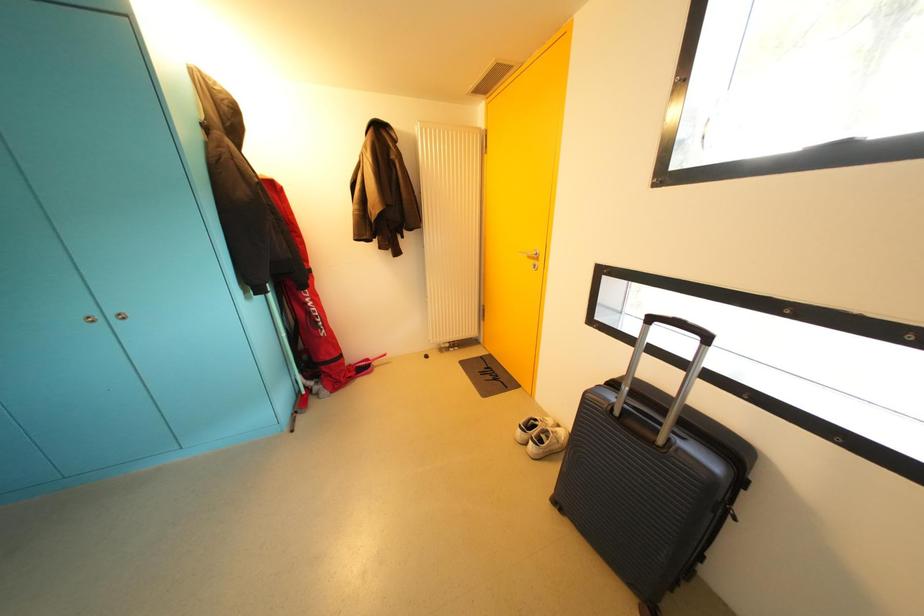
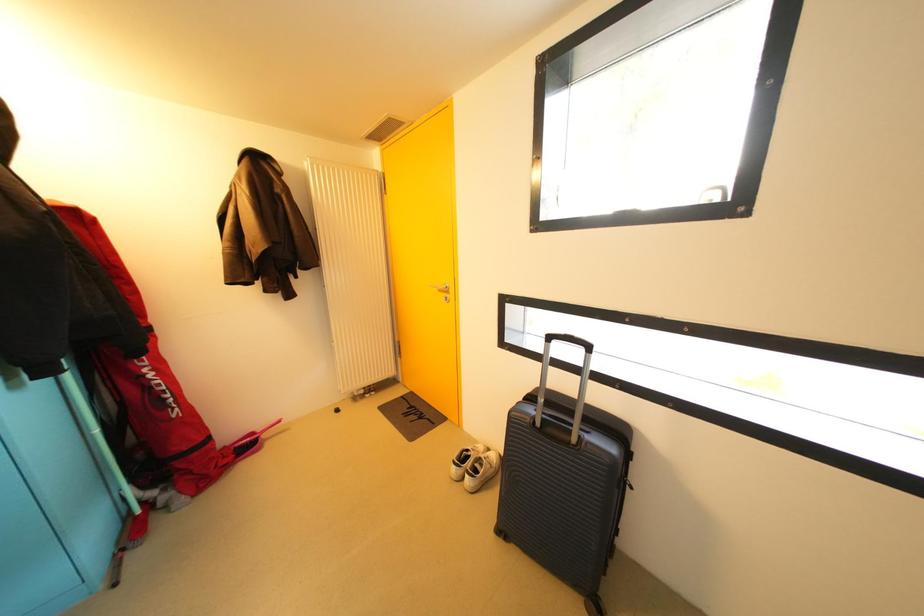
Question: How did the camera likely rotate?

Choices:
 (A) Left
 (B) Right
 (C) Up
 (D) Down

Answer: (B)